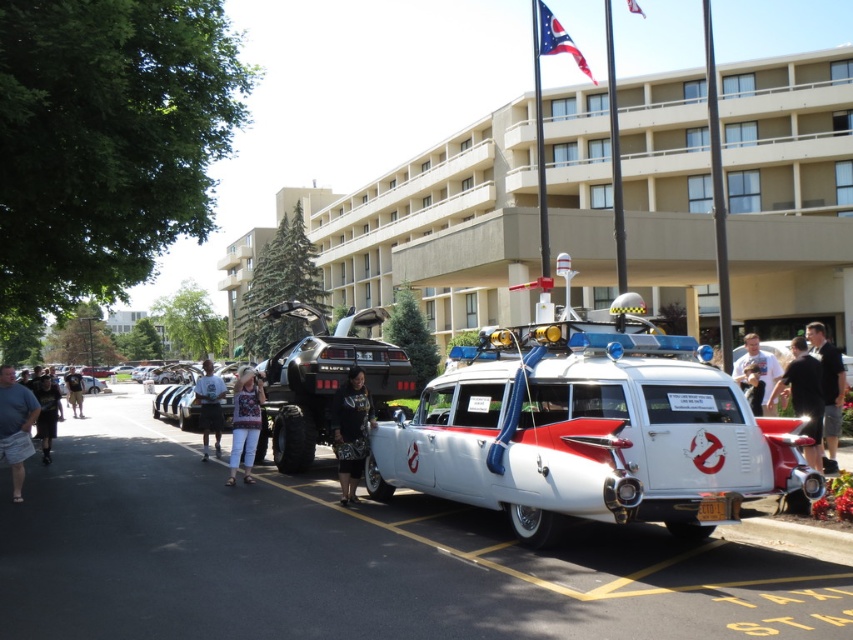
You are standing in the outdoor scene described. You want to take a photo of the white glossy car at center without including the denim pants at center in the frame. Based on their positions, which side should you position yourself to achieve this?

The white glossy car at center is to the left of the denim pants at center. To avoid including the denim pants at center in the photo, you should position yourself to the right side of the denim pants at center so that the car is framed without the pants.

You are a photographer trying to capture a wide shot of the beige concrete building at center and the dark blue denim jacket at center. Given that the building is wider than the jacket, how should you adjust your camera angle to ensure both are fully in frame?

Since the beige concrete building at center is wider than the dark blue denim jacket at center, you should position your camera to focus on the building first, ensuring its full width is captured, then adjust the angle slightly to include the jacket without cropping either subject.

You are a photographer trying to capture a photo of the white glossy car at center and the denim pants at center. Based on their heights, which one should you focus on first if you want to frame them properly?

The white glossy car at center is not as tall as the denim pants at center, so you should focus on the denim pants at center first to ensure proper framing.